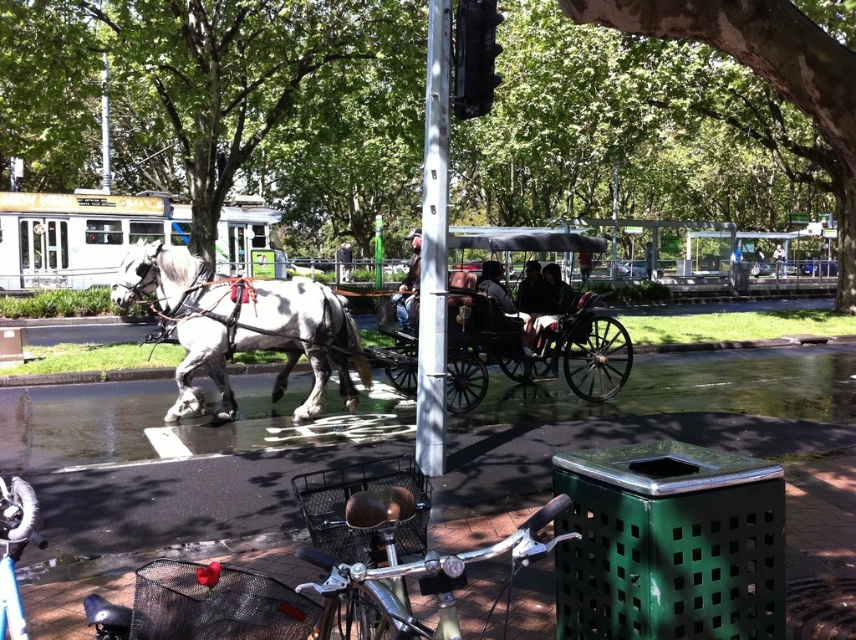
Question: Which of the following is the closest to the observer?

Choices:
 (A) (290, 346)
 (B) (408, 268)

Answer: (A)

Question: Does wooden polished cart at center have a greater width compared to wooden coach at center?

Choices:
 (A) yes
 (B) no

Answer: (A)

Question: Is the position of wooden polished cart at center more distant than that of wooden coach at center?

Choices:
 (A) no
 (B) yes

Answer: (A)

Question: Can you confirm if gray glossy horse at center is bigger than wooden polished cart at center?

Choices:
 (A) yes
 (B) no

Answer: (B)

Question: Which object appears farthest from the camera in this image?

Choices:
 (A) wooden coach at center
 (B) gray glossy horse at center
 (C) wooden polished cart at center

Answer: (A)

Question: Which object is farther from the camera taking this photo?

Choices:
 (A) wooden coach at center
 (B) gray glossy horse at center

Answer: (A)